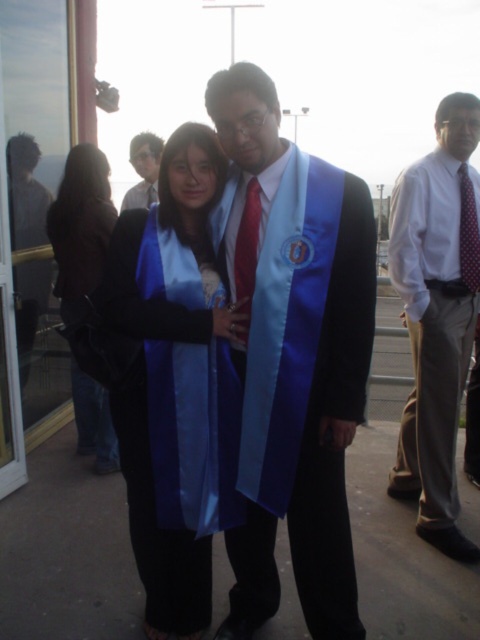
Can you confirm if dark gray fabric jacket at left is shorter than red satin tie at center?

No, dark gray fabric jacket at left is not shorter than red satin tie at center.

Consider the image. Is dark gray fabric jacket at left to the right of red satin tie at center from the viewer's perspective?

No, dark gray fabric jacket at left is not to the right of red satin tie at center.

Find the location of a particular element. This screenshot has height=640, width=480. dark gray fabric jacket at left is located at coordinates (25, 193).

Who is lower down, satin blue sash at center or red satin tie at center?

satin blue sash at center

Between satin blue sash at center and red satin tie at center, which one appears on the right side from the viewer's perspective?

From the viewer's perspective, satin blue sash at center appears more on the right side.

Describe the element at coordinates (295, 365) in the screenshot. The image size is (480, 640). I see `satin blue sash at center` at that location.

Find the location of a particular element. The height and width of the screenshot is (640, 480). satin blue sash at center is located at coordinates (295, 365).

Does white shirt at center have a greater height compared to dark gray fabric jacket at left?

Yes, white shirt at center is taller than dark gray fabric jacket at left.

Describe the element at coordinates (436, 316) in the screenshot. The image size is (480, 640). I see `white shirt at center` at that location.

This screenshot has height=640, width=480. What do you see at coordinates (436, 316) in the screenshot? I see `white shirt at center` at bounding box center [436, 316].

Where is `white shirt at center`? This screenshot has height=640, width=480. white shirt at center is located at coordinates (436, 316).